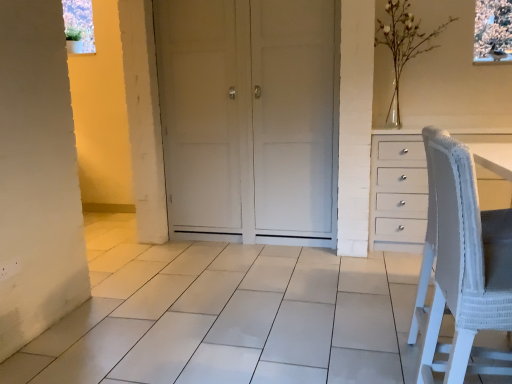
Question: From a real-world perspective, does white glass vase at upper right sit lower than white matte door at center?

Choices:
 (A) yes
 (B) no

Answer: (B)

Question: Can you confirm if white glass vase at upper right is taller than white matte door at center?

Choices:
 (A) yes
 (B) no

Answer: (B)

Question: Is white glass vase at upper right wider than white matte door at center?

Choices:
 (A) no
 (B) yes

Answer: (A)

Question: From the image's perspective, is white glass vase at upper right under white matte door at center?

Choices:
 (A) no
 (B) yes

Answer: (A)

Question: Considering the relative sizes of white glass vase at upper right and white matte door at center in the image provided, is white glass vase at upper right shorter than white matte door at center?

Choices:
 (A) no
 (B) yes

Answer: (B)

Question: Considering their positions, is white woven fabric chair at right located in front of or behind white glass vase at upper right?

Choices:
 (A) front
 (B) behind

Answer: (A)

Question: Based on their sizes in the image, would you say white woven fabric chair at right is bigger or smaller than white glass vase at upper right?

Choices:
 (A) big
 (B) small

Answer: (B)

Question: From their relative heights in the image, would you say white woven fabric chair at right is taller or shorter than white glass vase at upper right?

Choices:
 (A) short
 (B) tall

Answer: (A)

Question: Is point (435, 150) closer or farther from the camera than point (409, 3)?

Choices:
 (A) closer
 (B) farther

Answer: (A)

Question: Considering the positions of point (180, 87) and point (471, 249), is point (180, 87) closer or farther from the camera than point (471, 249)?

Choices:
 (A) farther
 (B) closer

Answer: (A)

Question: From a real-world perspective, is white matte door at center positioned above or below white woven fabric chair at right?

Choices:
 (A) above
 (B) below

Answer: (A)

Question: In the image, is white matte door at center positioned in front of or behind white woven fabric chair at right?

Choices:
 (A) front
 (B) behind

Answer: (B)

Question: Is white matte door at center bigger or smaller than white woven fabric chair at right?

Choices:
 (A) small
 (B) big

Answer: (B)

Question: Considering the positions of white glass vase at upper right and white matte door at center in the image, is white glass vase at upper right taller or shorter than white matte door at center?

Choices:
 (A) short
 (B) tall

Answer: (A)

Question: In terms of width, does white glass vase at upper right look wider or thinner when compared to white matte door at center?

Choices:
 (A) wide
 (B) thin

Answer: (B)